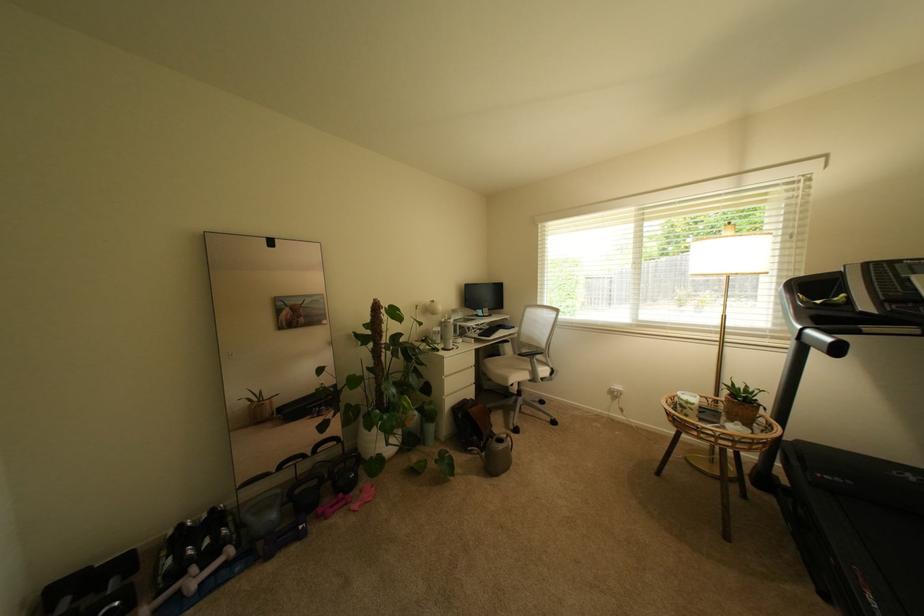
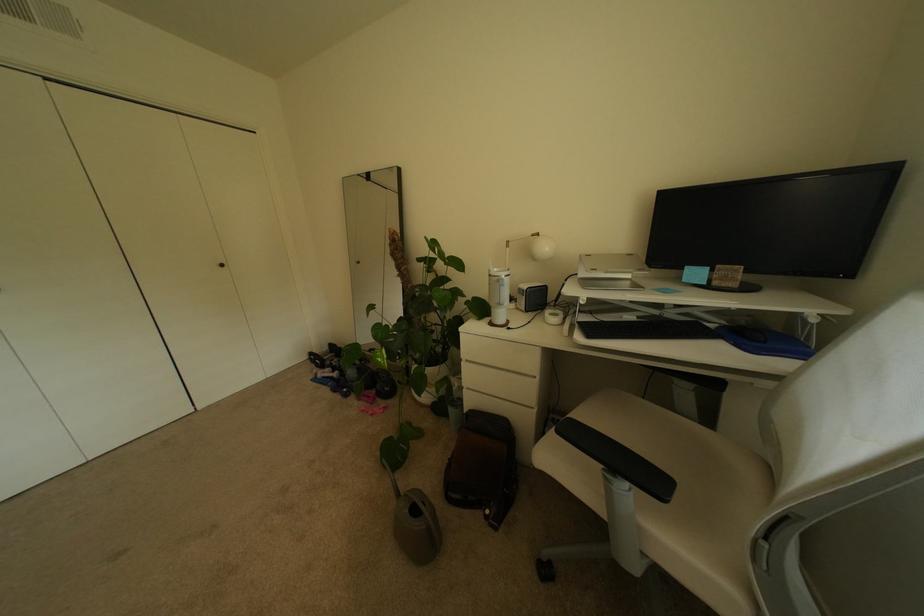
Where in the second image is the point corresponding to (x=234, y=565) from the first image?

(341, 379)